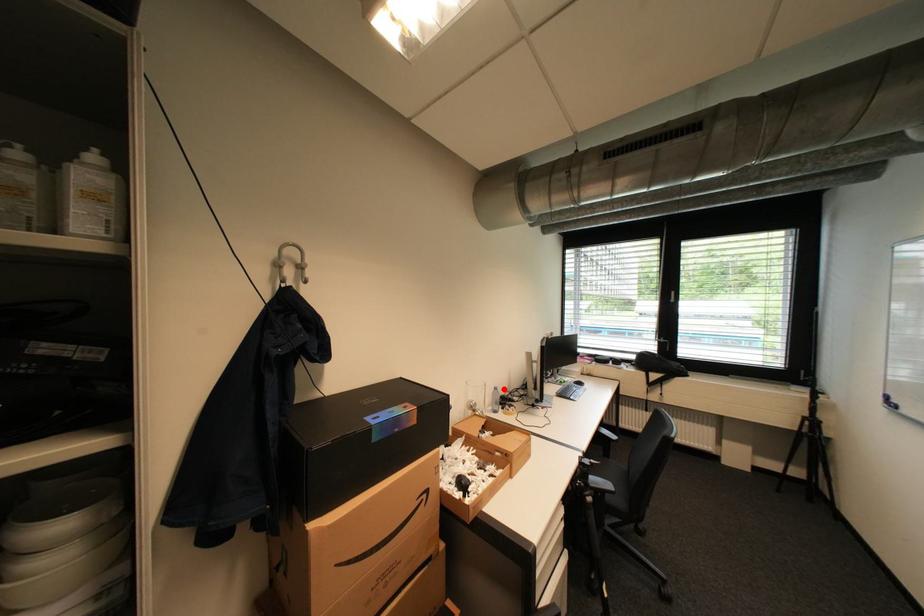
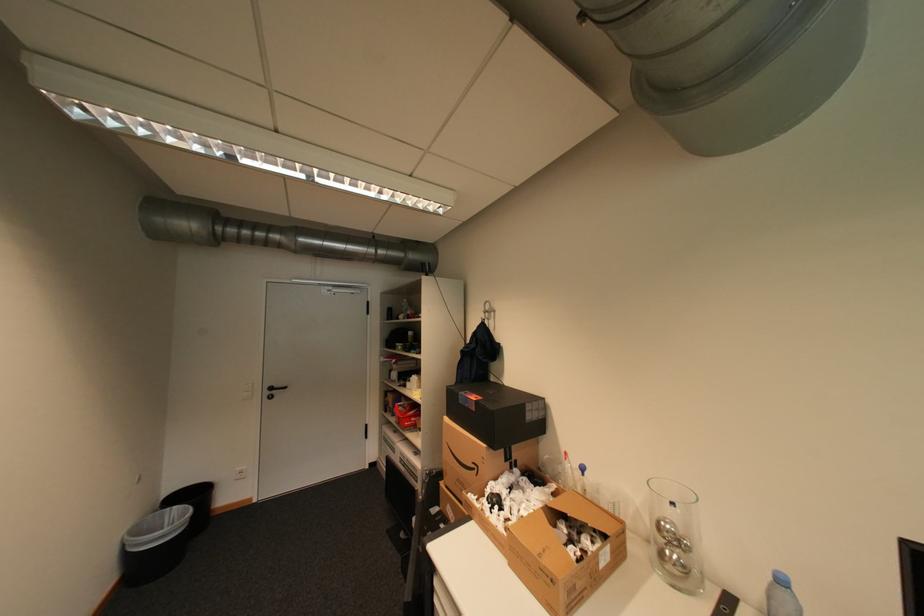
In the second image, find the point that corresponds to the highlighted location in the first image.

(791, 582)